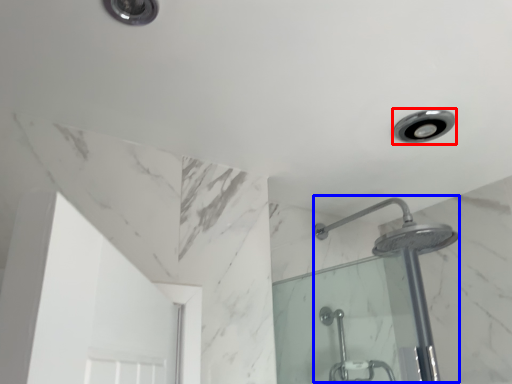
Question: Which of the following is the farthest to the observer, light fixture (highlighted by a red box) or shower (highlighted by a blue box)?

Choices:
 (A) light fixture
 (B) shower

Answer: (A)